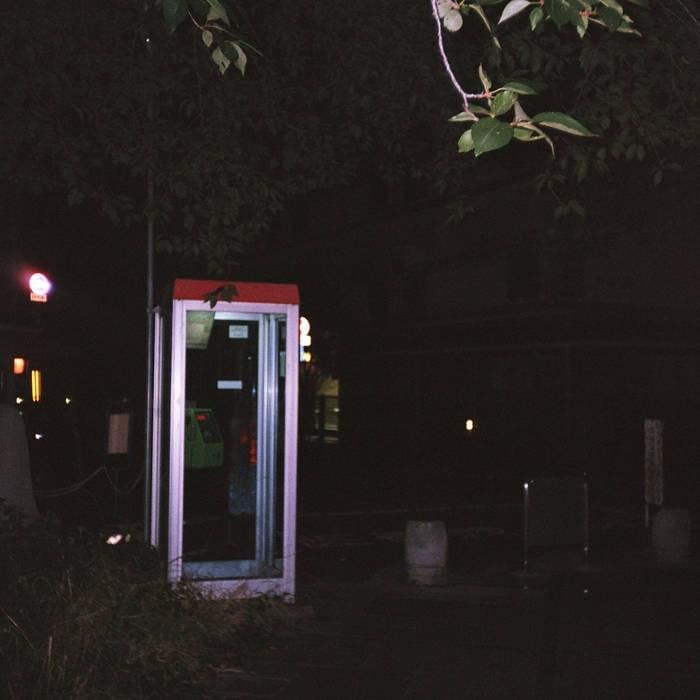
Locate an element on the screen. The image size is (700, 700). glass is located at coordinates (220, 404).